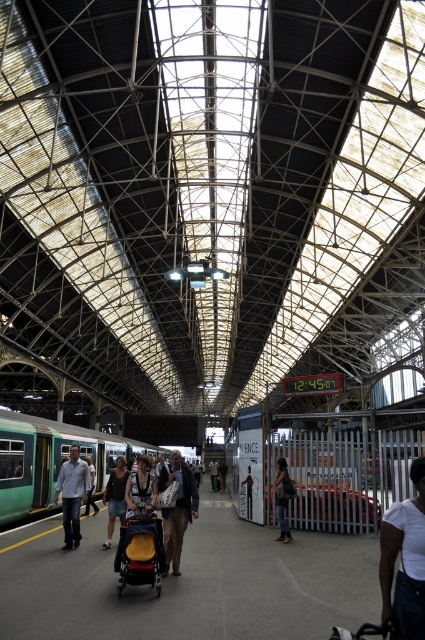
Question: Considering the relative positions of green matte train at center and yellow fabric baby carriage at center in the image provided, where is green matte train at center located with respect to yellow fabric baby carriage at center?

Choices:
 (A) below
 (B) above

Answer: (A)

Question: Is yellow fabric baby carriage at center closer to camera compared to dark gray fabric backpack at center?

Choices:
 (A) no
 (B) yes

Answer: (B)

Question: Can you confirm if denim jacket at center is wider than dark gray fabric backpack at center?

Choices:
 (A) yes
 (B) no

Answer: (A)

Question: Which of the following is the farthest from the observer?

Choices:
 (A) (337, 474)
 (B) (139, 566)
 (C) (274, 483)

Answer: (C)

Question: Estimate the real-world distances between objects in this image. Which object is closer to the denim jacket at center?

Choices:
 (A) green matte train at center
 (B) yellow fabric baby carriage at center

Answer: (B)

Question: Considering the real-world distances, which object is farthest from the yellow fabric baby carriage at center?

Choices:
 (A) dark gray fabric backpack at center
 (B) denim jacket at center
 (C) green matte train at center
 (D) light blue shirt at left

Answer: (C)